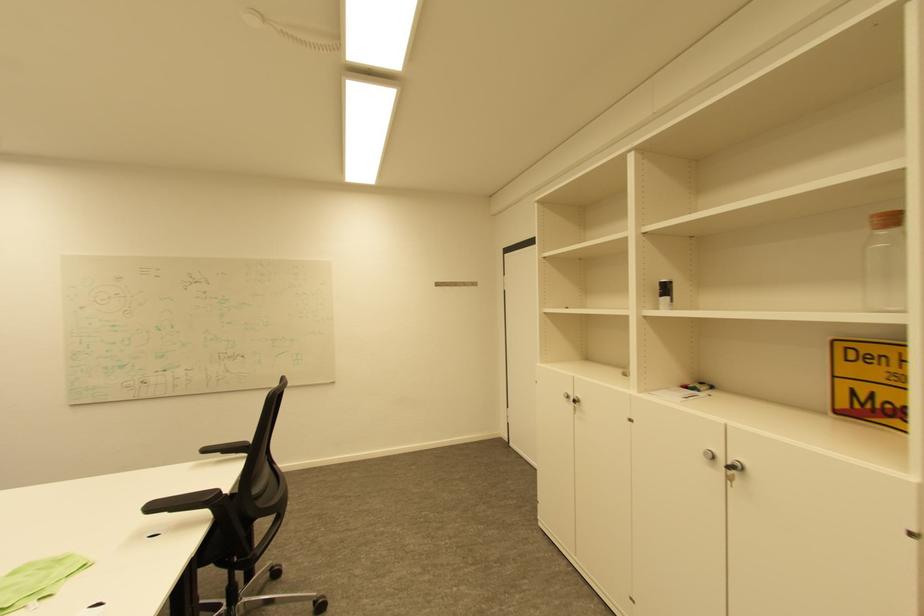
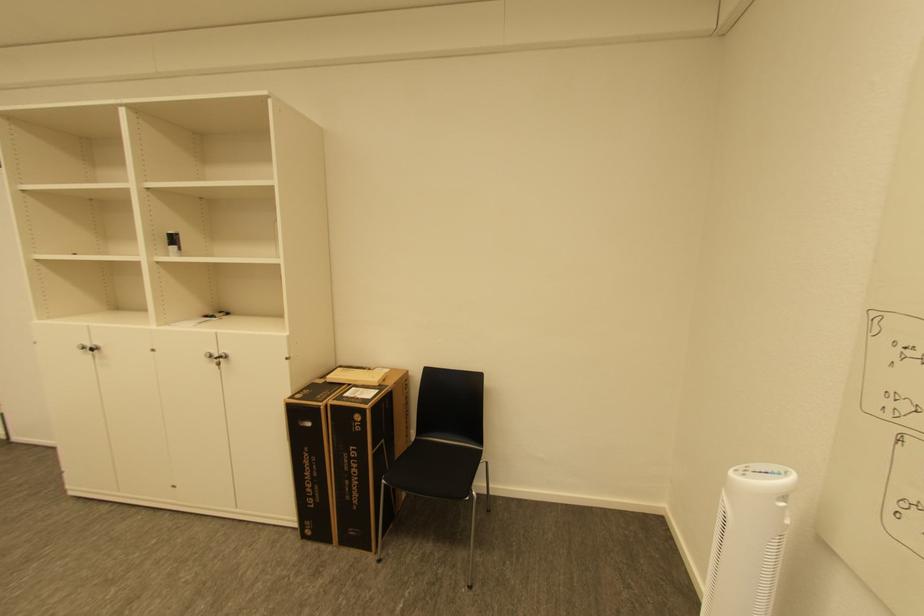
In the second image, find the point that corresponds to [667,296] in the first image.

(176, 245)